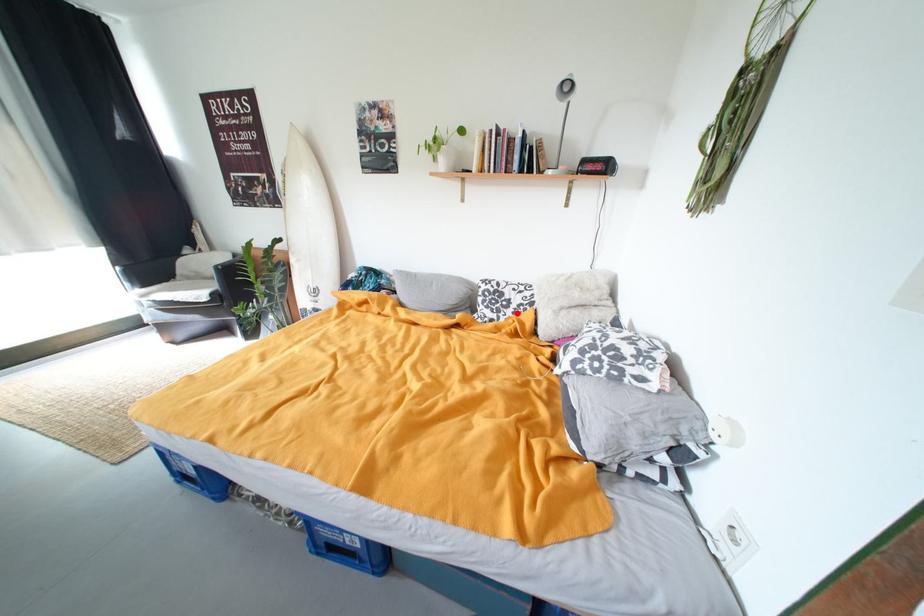
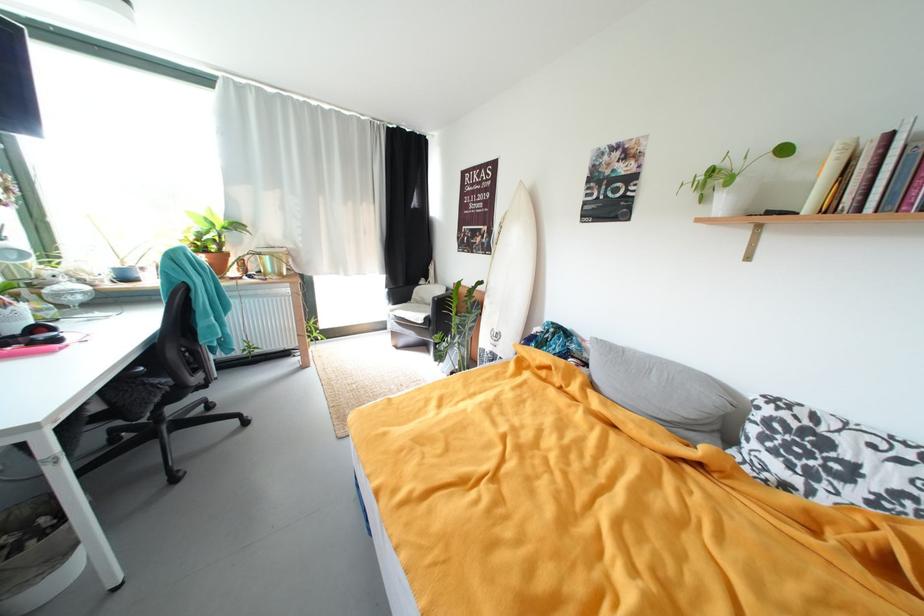
Question: I am providing you with two images of the same scene from different viewpoints. Image1 has a red point marked. In image2, the corresponding 3D location appears at what relative position? Reply with the corresponding letter.

Choices:
 (A) Closer
 (B) Farther

Answer: (B)